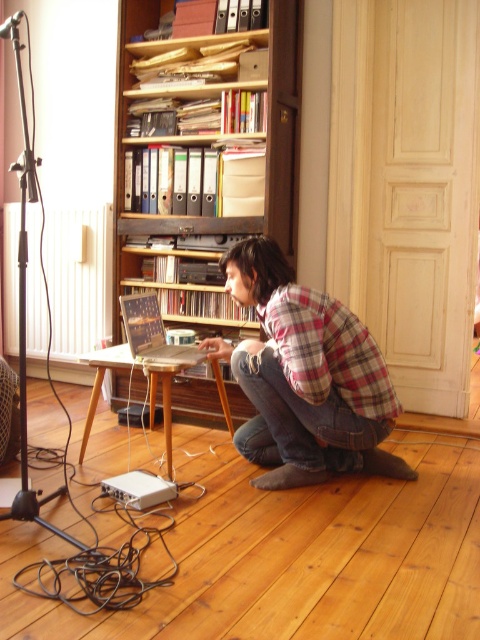
Question: Among these points, which one is farthest from the camera?

Choices:
 (A) (157, 324)
 (B) (292, 365)
 (C) (155, 269)

Answer: (C)

Question: Where is wooden bookshelf at upper center located in relation to plaid flannel shirt at center in the image?

Choices:
 (A) right
 (B) left

Answer: (B)

Question: Estimate the real-world distances between objects in this image. Which object is farther from the wooden bookshelf at upper center?

Choices:
 (A) plaid flannel shirt at center
 (B) wooden laptop at center

Answer: (A)

Question: Is wooden bookshelf at upper center below wooden laptop at center?

Choices:
 (A) yes
 (B) no

Answer: (B)

Question: Is wooden bookshelf at upper center to the left of wooden laptop at center from the viewer's perspective?

Choices:
 (A) no
 (B) yes

Answer: (A)

Question: Which point is farther to the camera?

Choices:
 (A) plaid flannel shirt at center
 (B) wooden laptop at center
 (C) wooden bookshelf at upper center

Answer: (C)